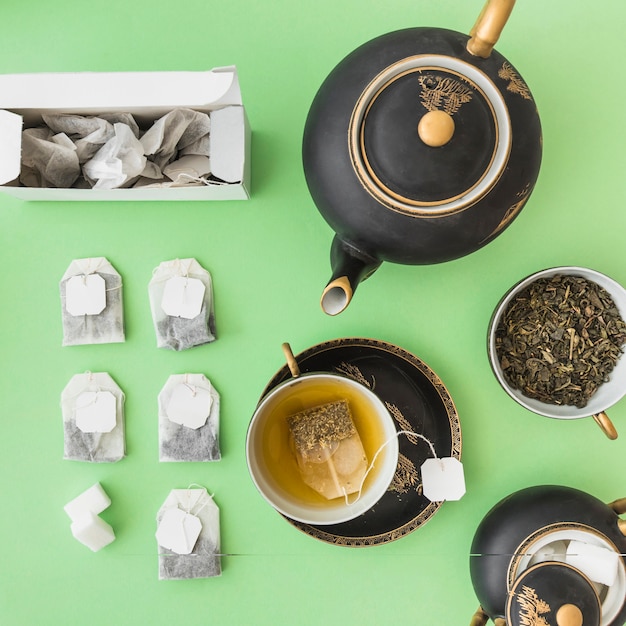
Identify the location of green table. tap(272, 270).